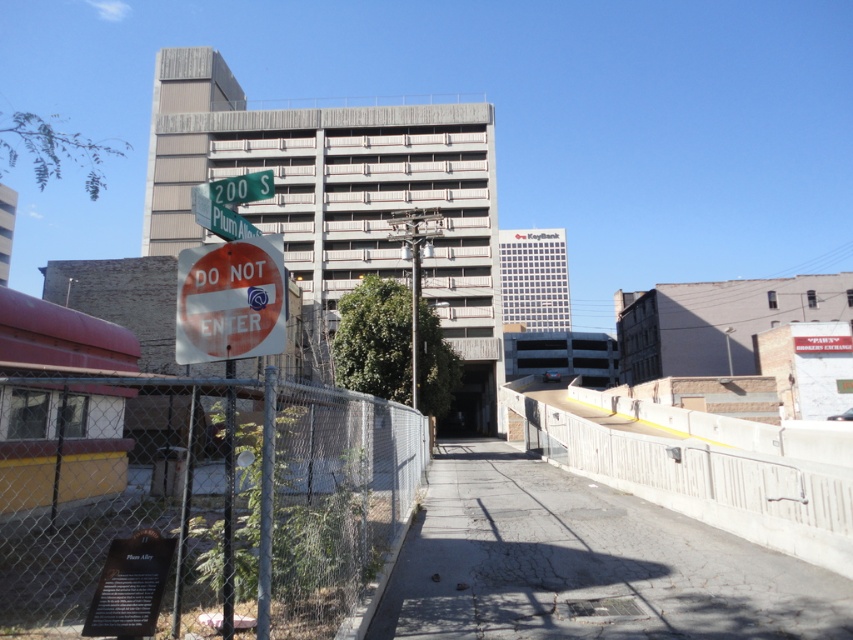
Question: Based on their relative distances, which object is nearer to the green metallic street sign at upper center?

Choices:
 (A) red matte sign at center
 (B) concrete at center

Answer: (A)

Question: Does red matte sign at center have a greater width compared to green metallic street sign at upper center?

Choices:
 (A) no
 (B) yes

Answer: (A)

Question: Does concrete at center have a lesser width compared to red matte sign at center?

Choices:
 (A) no
 (B) yes

Answer: (A)

Question: Which is farther from the red matte sign at center?

Choices:
 (A) chain link fence at lower left
 (B) concrete at center
 (C) green metallic street sign at upper center

Answer: (B)

Question: In this image, where is concrete at center located relative to green metallic street sign at upper center?

Choices:
 (A) below
 (B) above

Answer: (A)

Question: Which point appears farthest from the camera in this image?

Choices:
 (A) (341, 419)
 (B) (207, 184)

Answer: (A)